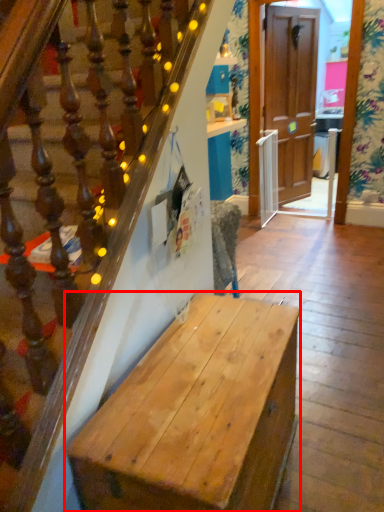
Question: From the image's perspective, where is desk (annotated by the red box) located relative to door?

Choices:
 (A) above
 (B) below

Answer: (B)